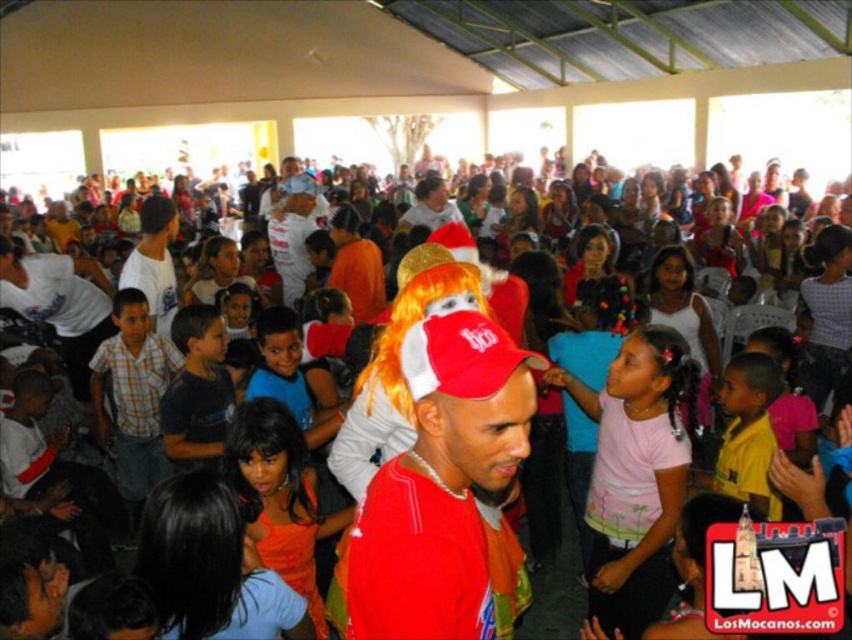
You are a photographer trying to capture a clear photo of the red matte cap at center and the pink cotton shirt at center. Since you want both subjects in focus, you need to know which one is closer to the camera. Can you determine which object is nearer based on their heights in the image?

The red matte cap at center has a lesser height compared to the pink cotton shirt at center, so the pink cotton shirt at center is closer to the camera.